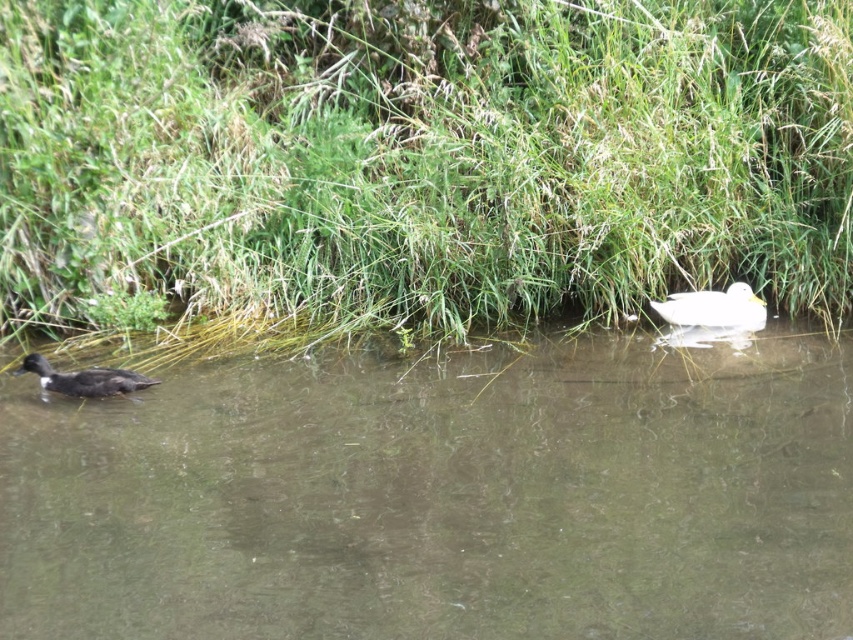
You are observing two ducks in a pond. You notice a white matte duck at upper center and a dark brown feathers at lower left. Which duck has a smaller width?

The white matte duck at upper center is thinner than the dark brown feathers at lower left, so the white matte duck at upper center has a smaller width.

You are standing on the shore observing the scene. You see the brown murky water at lower left and the white matte duck at upper center. Which object is positioned higher in the image?

The white matte duck at upper center is positioned higher in the image than the brown murky water at lower left.